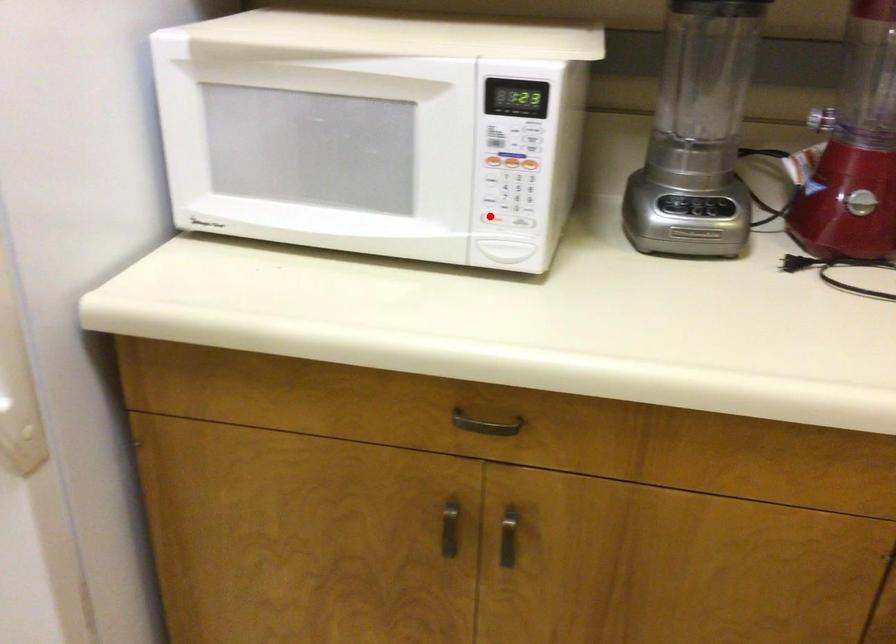
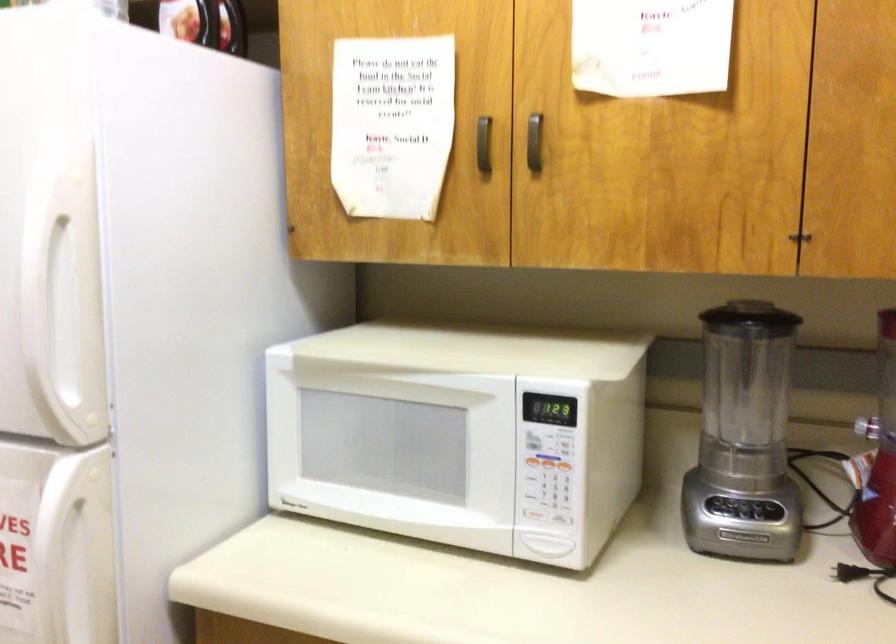
Find the pixel in the second image that matches the highlighted location in the first image.

(533, 515)